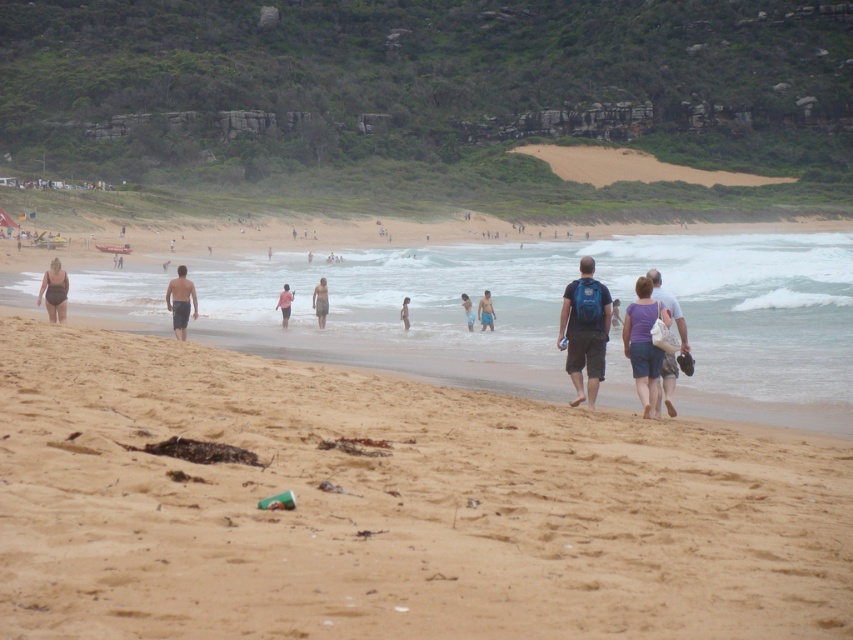
You are planning to pack your belongings into the purple fabric bag at center and the matte white bag at center. Which bag can hold more items based on their sizes?

The matte white bag at center can hold more items since it is larger than the purple fabric bag at center.

You are standing at the point marked as point (392, 506) in the image. What is the terrain like at that location?

The terrain at point (392, 506) is brown sandy beach at lower left.